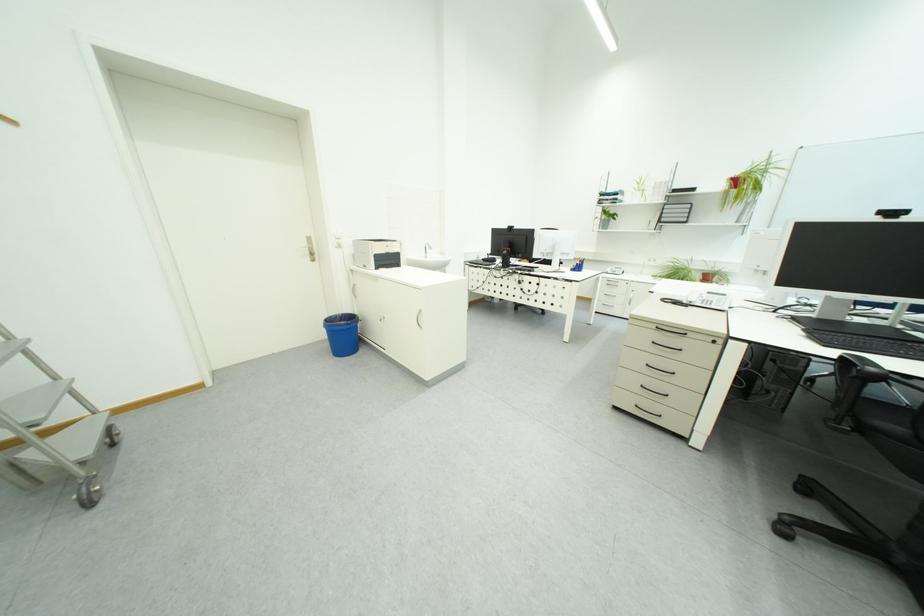
You are a GUI agent. You are given a task and a screenshot of the screen. Output one action in this format:
    pyautogui.click(x=<x>, y=<y>)
    Task: Click on the black cabinet handle
    
    Given the screenshot: What is the action you would take?
    pyautogui.click(x=648, y=411)